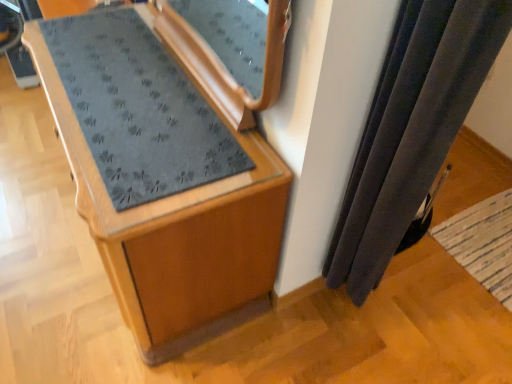
Question: Is velvet dark gray curtain at right closer to the viewer compared to wooden cabinet at center?

Choices:
 (A) no
 (B) yes

Answer: (B)

Question: Can you confirm if velvet dark gray curtain at right is shorter than wooden cabinet at center?

Choices:
 (A) yes
 (B) no

Answer: (B)

Question: Does velvet dark gray curtain at right have a smaller size compared to wooden cabinet at center?

Choices:
 (A) yes
 (B) no

Answer: (A)

Question: Does velvet dark gray curtain at right appear on the left side of wooden cabinet at center?

Choices:
 (A) yes
 (B) no

Answer: (B)

Question: From the image's perspective, is velvet dark gray curtain at right located beneath wooden cabinet at center?

Choices:
 (A) no
 (B) yes

Answer: (B)

Question: Is point (356, 205) closer or farther from the camera than point (224, 173)?

Choices:
 (A) closer
 (B) farther

Answer: (B)

Question: Visually, is velvet dark gray curtain at right positioned to the left or to the right of wooden cabinet at center?

Choices:
 (A) right
 (B) left

Answer: (A)

Question: Considering the positions of velvet dark gray curtain at right and wooden cabinet at center in the image, is velvet dark gray curtain at right bigger or smaller than wooden cabinet at center?

Choices:
 (A) big
 (B) small

Answer: (B)

Question: Is velvet dark gray curtain at right inside or outside of wooden cabinet at center?

Choices:
 (A) inside
 (B) outside

Answer: (B)

Question: Choose the correct answer: Is wooden cabinet at center inside velvet dark gray curtain at right or outside it?

Choices:
 (A) outside
 (B) inside

Answer: (A)

Question: Is point (184, 46) closer or farther from the camera than point (374, 180)?

Choices:
 (A) closer
 (B) farther

Answer: (B)

Question: From a real-world perspective, is wooden cabinet at center physically located above or below velvet dark gray curtain at right?

Choices:
 (A) above
 (B) below

Answer: (B)

Question: From their relative heights in the image, would you say wooden cabinet at center is taller or shorter than velvet dark gray curtain at right?

Choices:
 (A) tall
 (B) short

Answer: (B)

Question: In terms of width, does velvet dark gray curtain at right look wider or thinner when compared to woven beige mat at lower right?

Choices:
 (A) thin
 (B) wide

Answer: (A)

Question: From the image's perspective, is velvet dark gray curtain at right above or below woven beige mat at lower right?

Choices:
 (A) below
 (B) above

Answer: (B)